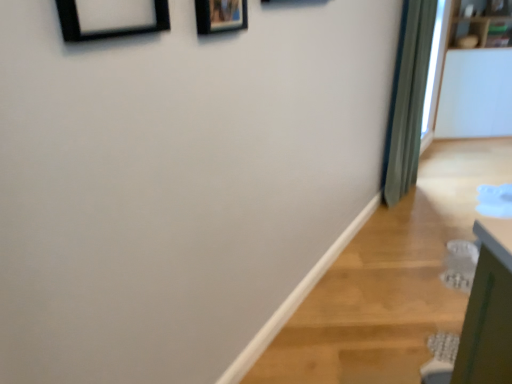
Question: Considering the positions of point (394, 87) and point (64, 21), is point (394, 87) closer or farther from the camera than point (64, 21)?

Choices:
 (A) farther
 (B) closer

Answer: (A)

Question: From the image's perspective, is green fabric curtain at right located above or below black matte picture frame at upper left, placed as the 1th picture frame when sorted from left to right?

Choices:
 (A) above
 (B) below

Answer: (A)

Question: Which of these objects is positioned closest to the black matte picture frame at upper left, placed as the 2th picture frame when sorted from back to front?

Choices:
 (A) green fabric curtain at right
 (B) wooden picture frame at upper center, which ranks as the 2th picture frame in left-to-right order

Answer: (B)

Question: Estimate the real-world distances between objects in this image. Which object is farther from the green fabric curtain at right?

Choices:
 (A) black matte picture frame at upper left, placed as the 1th picture frame when sorted from left to right
 (B) wooden picture frame at upper center, acting as the 1th picture frame starting from the right

Answer: (A)